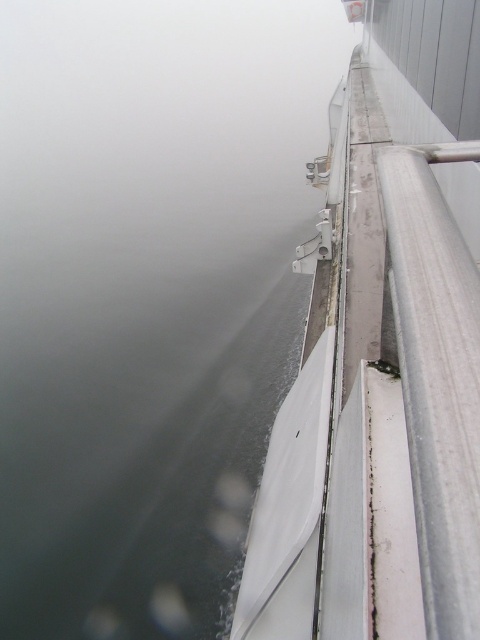
Question: Is gray matte water at upper left thinner than white matte boat at upper right?

Choices:
 (A) yes
 (B) no

Answer: (B)

Question: Can you confirm if gray matte water at upper left is wider than white matte boat at upper right?

Choices:
 (A) no
 (B) yes

Answer: (B)

Question: Which point is closer to the camera taking this photo?

Choices:
 (A) (435, 248)
 (B) (79, 54)

Answer: (A)

Question: Can you confirm if gray matte water at upper left is positioned to the left of white matte boat at upper right?

Choices:
 (A) no
 (B) yes

Answer: (B)

Question: Among these points, which one is farthest from the camera?

Choices:
 (A) (456, 300)
 (B) (183, 420)

Answer: (B)